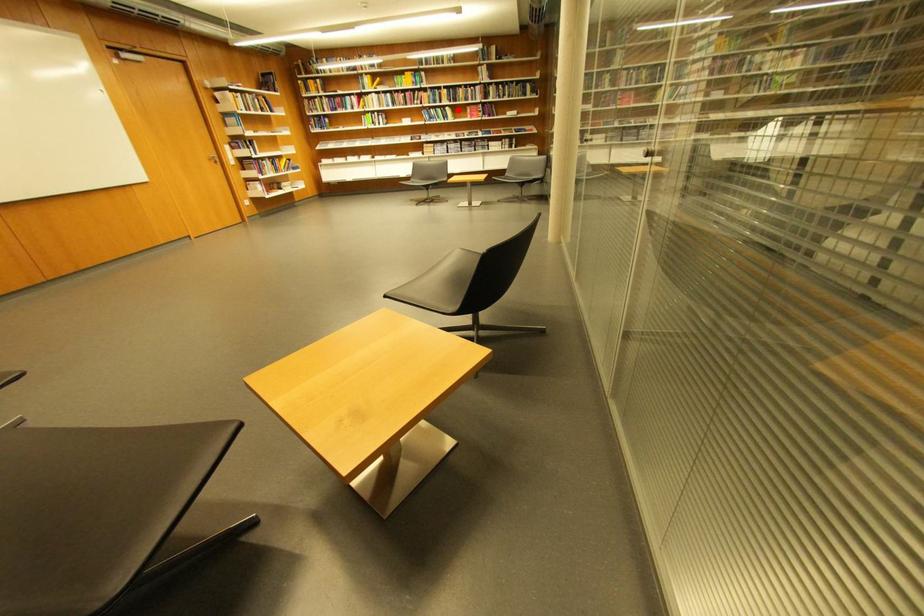
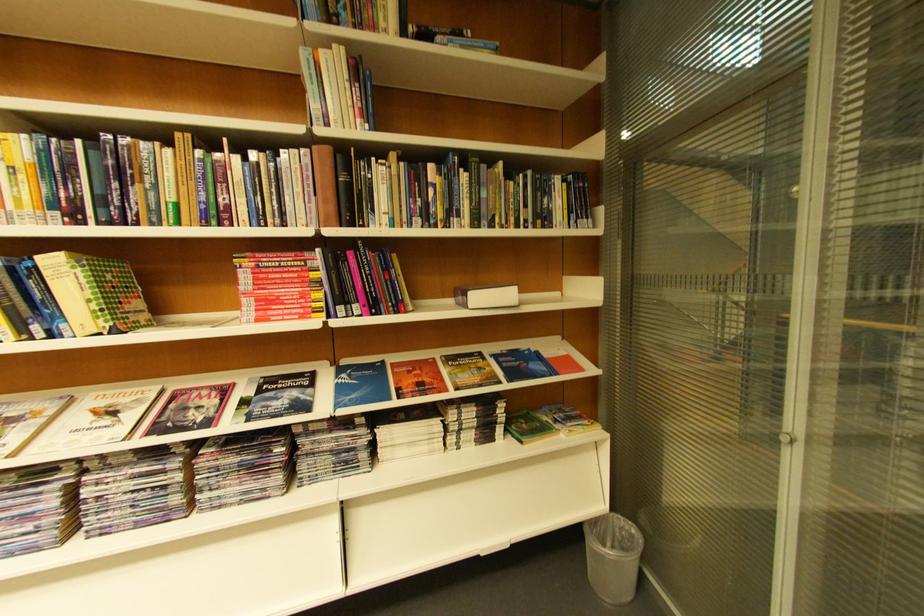
Locate, in the second image, the point that corresponds to the highlighted location in the first image.

(63, 264)